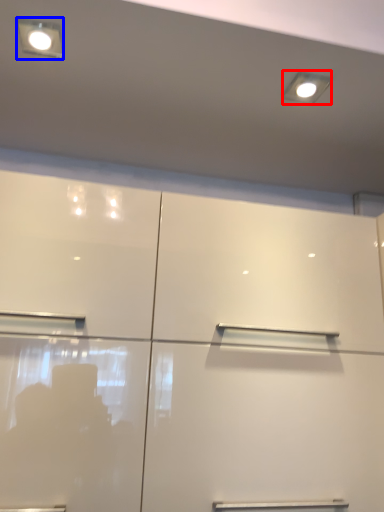
Question: Which object is further to the camera taking this photo, lighting (highlighted by a red box) or light fixture (highlighted by a blue box)?

Choices:
 (A) lighting
 (B) light fixture

Answer: (A)